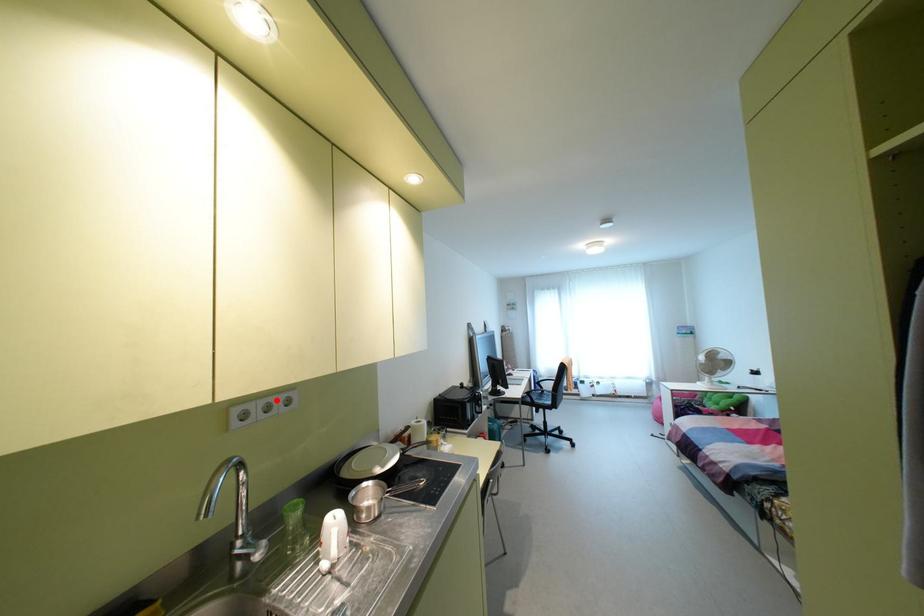
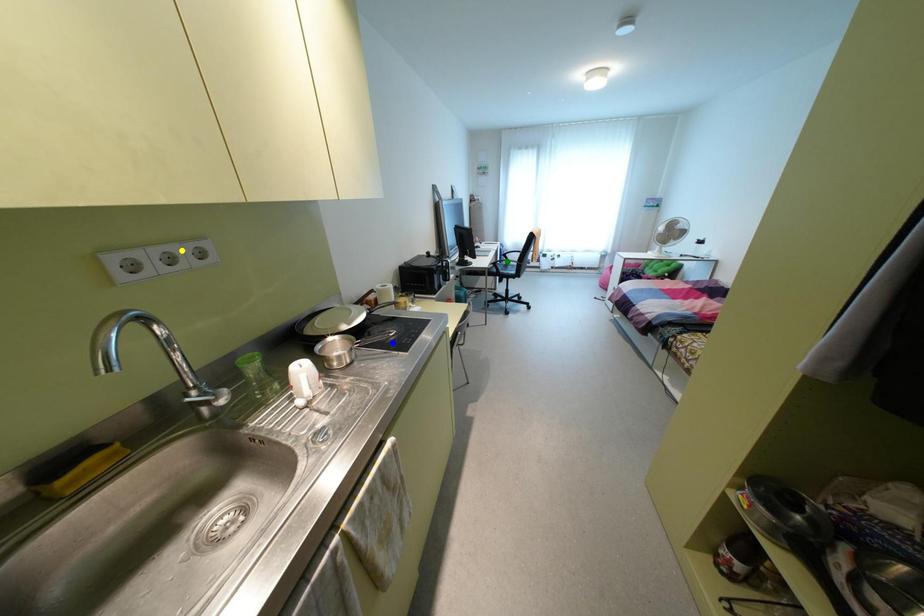
Question: I am providing you with two images of the same scene from different viewpoints. A red point is marked on the first image. You are given multiple points on the second image. Which point in image 2 represents the same 3d spot as the red point in image 1?

Choices:
 (A) yellow point
 (B) blue point
 (C) green point

Answer: (A)